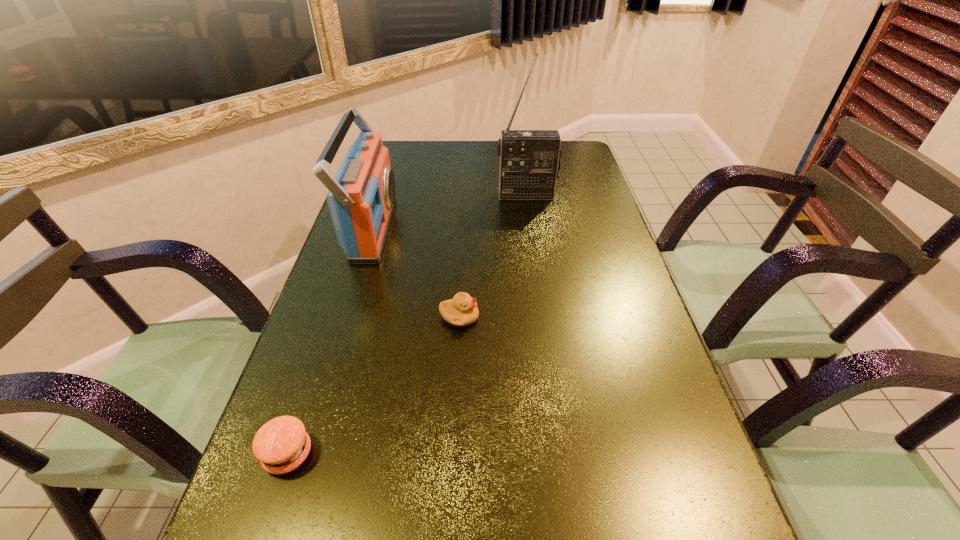
Find the location of a particular element. This screenshot has width=960, height=540. free space that is in between the duckling and the third shortest object is located at coordinates (416, 273).

Where is `free space between the second object from right to left and the tallest object`? This screenshot has height=540, width=960. free space between the second object from right to left and the tallest object is located at coordinates point(492,256).

You are a GUI agent. You are given a task and a screenshot of the screen. Output one action in this format:
    pyautogui.click(x=<x>, y=<y>)
    Task: Click on the free space between the third farthest object and the taller radio receiver
    
    Given the screenshot: What is the action you would take?
    pyautogui.click(x=492, y=256)

The width and height of the screenshot is (960, 540). What are the coordinates of `free area in between the patty and the second tallest object` in the screenshot? It's located at (330, 341).

Identify the location of blank region between the duckling and the right radio receiver. coord(492,256).

Find the location of a particular element. free space between the second tallest object and the right radio receiver is located at coordinates coord(449,212).

Locate an element on the screen. vacant space that is in between the right radio receiver and the patty is located at coordinates (407, 325).

This screenshot has height=540, width=960. Find the location of `free area in between the left radio receiver and the right radio receiver`. free area in between the left radio receiver and the right radio receiver is located at coordinates (449, 212).

Identify the location of object that is the closest to the third farthest object. (361, 197).

Image resolution: width=960 pixels, height=540 pixels. Find the location of `object that is the third closest to the rightmost object`. object that is the third closest to the rightmost object is located at coordinates (281, 445).